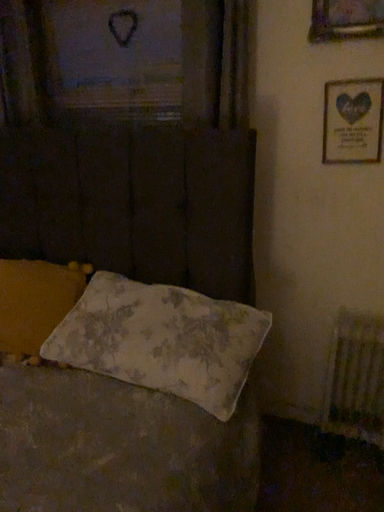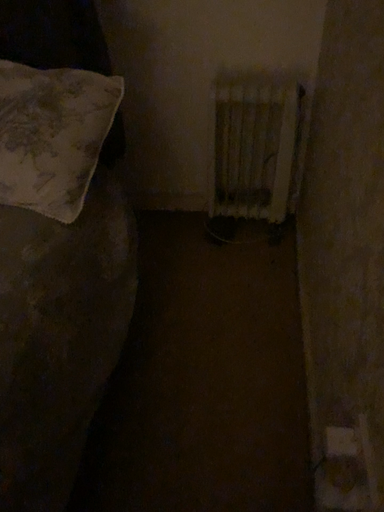
Question: How did the camera likely rotate when shooting the video?

Choices:
 (A) rotated left
 (B) rotated right

Answer: (B)